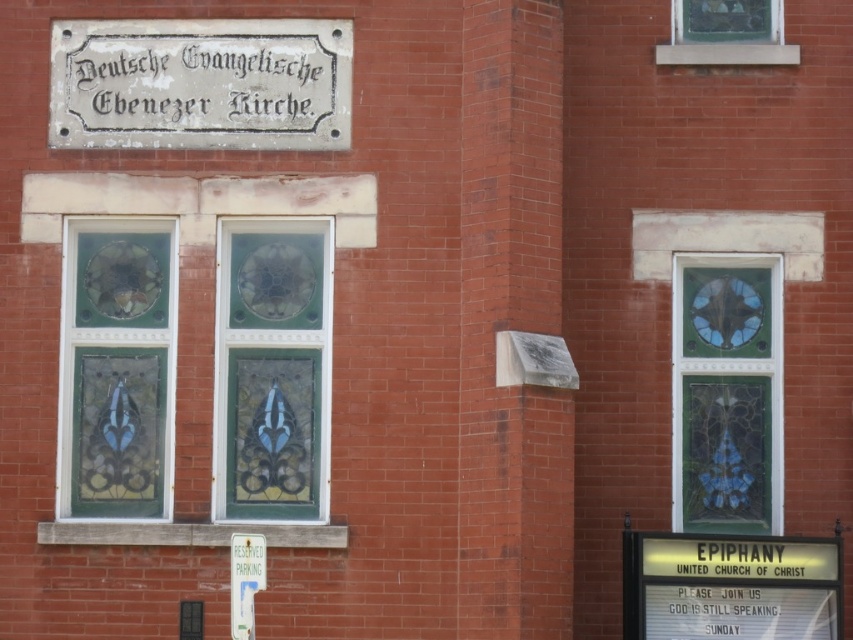
How far apart are stained glass window at center left and stained glass window at right?

A distance of 10.41 meters exists between stained glass window at center left and stained glass window at right.

Between point (155, 515) and point (709, 420), which one is positioned behind?

Point (709, 420)

Is point (132, 240) more distant than point (737, 515)?

That is False.

Identify the location of stained glass window at center left. pyautogui.click(x=115, y=369).

Can you confirm if stained glass window at center left is thinner than stained glass window at upper right?

Correct, stained glass window at center left's width is less than stained glass window at upper right's.

Between point (152, 307) and point (709, 51), which one is positioned in front?

Point (152, 307)

Where is `stained glass window at center left`? The height and width of the screenshot is (640, 853). stained glass window at center left is located at coordinates (115, 369).

Does stained glass window at upper right appear on the left side of white plastic reserved parking sign at lower center?

No, stained glass window at upper right is not to the left of white plastic reserved parking sign at lower center.

At what (x,y) coordinates should I click in order to perform the action: click on stained glass window at upper right. Please return your answer as a coordinate pair (x, y). Looking at the image, I should click on (726, 33).

Where is `stained glass window at upper right`? The width and height of the screenshot is (853, 640). stained glass window at upper right is located at coordinates (726, 33).